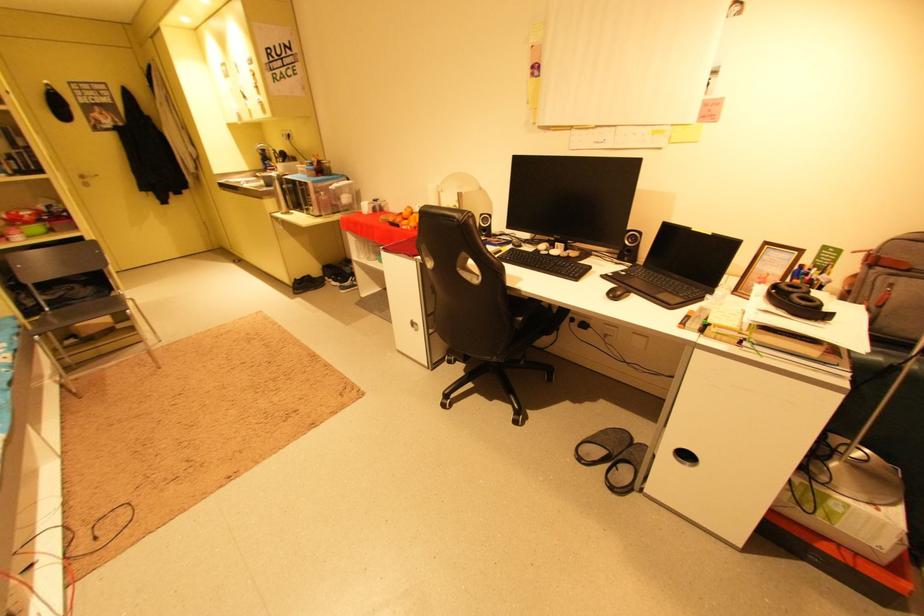
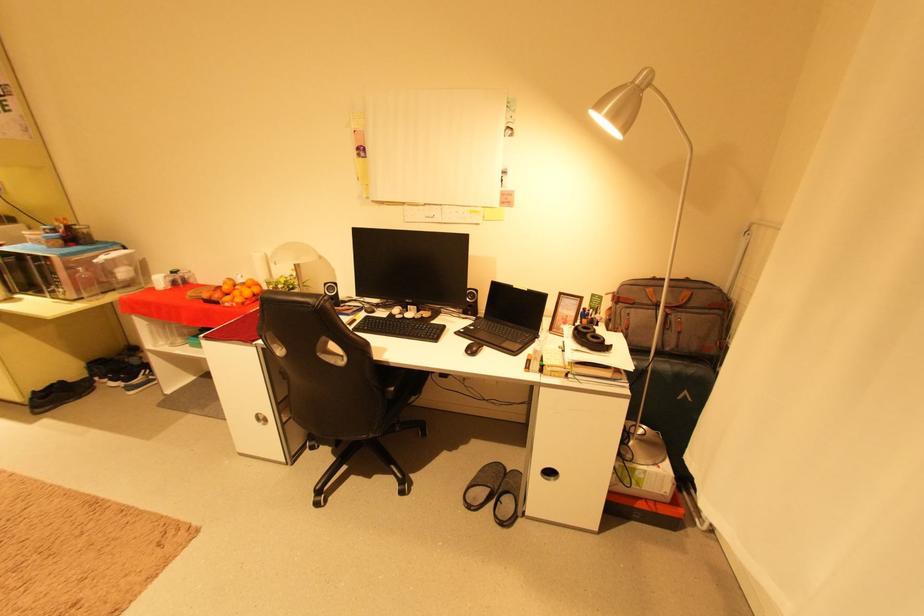
Where in the second image is the point corresponding to pixel 623 456 from the first image?

(504, 492)